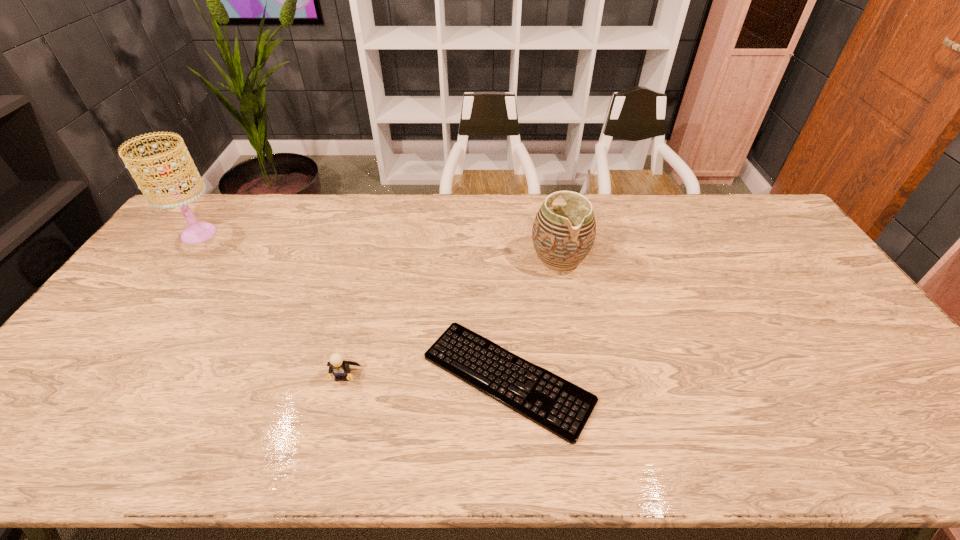
The image size is (960, 540). I want to click on the leftmost object, so click(197, 232).

The height and width of the screenshot is (540, 960). I want to click on the tallest object, so click(197, 232).

I want to click on pottery, so click(563, 235).

The width and height of the screenshot is (960, 540). Find the location of `the second shortest object`. the second shortest object is located at coordinates (338, 367).

Find the location of a particular element. Image resolution: width=960 pixels, height=540 pixels. Lego is located at coordinates (338, 367).

Locate an element on the screen. The height and width of the screenshot is (540, 960). computer keyboard is located at coordinates (557, 405).

At what (x,y) coordinates should I click in order to perform the action: click on free space located on the front of the tallest object. Please return your answer as a coordinate pair (x, y). This screenshot has width=960, height=540. Looking at the image, I should click on (160, 286).

Image resolution: width=960 pixels, height=540 pixels. Find the location of `vacant region located 0.260m on the front of the pottery`. vacant region located 0.260m on the front of the pottery is located at coordinates point(577,347).

At what (x,y) coordinates should I click in order to perform the action: click on free space located on the front-facing side of the third object from right to left. Please return your answer as a coordinate pair (x, y). Looking at the image, I should click on (330, 427).

Locate an element on the screen. free point located on the left of the shortest object is located at coordinates (370, 378).